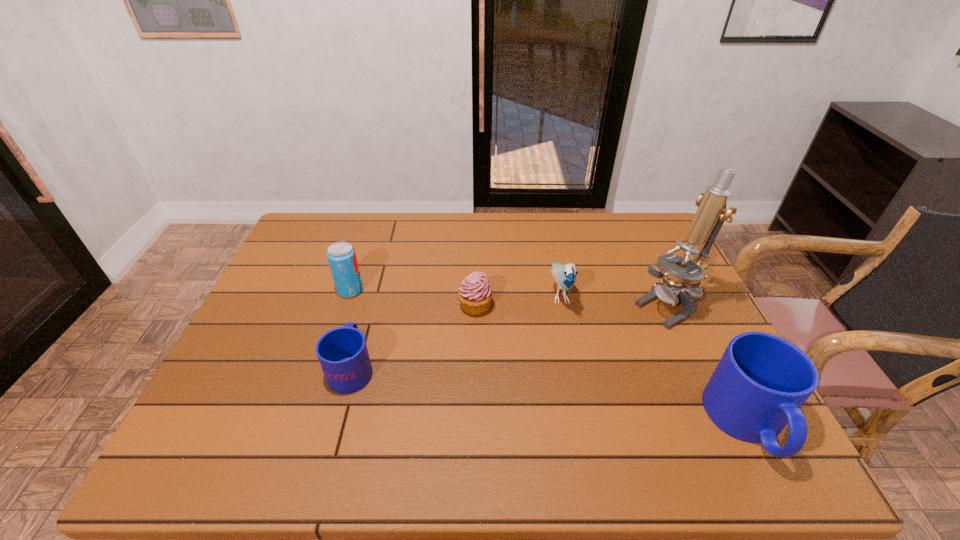
Locate an element on the screen. The image size is (960, 540). free area in between the tallest object and the cupcake is located at coordinates (572, 307).

Locate an element on the screen. The image size is (960, 540). vacant area that lies between the taller mug and the third object from right to left is located at coordinates (654, 357).

Find the location of a particular element. The height and width of the screenshot is (540, 960). object that ranks as the third closest to the soda can is located at coordinates (564, 276).

The height and width of the screenshot is (540, 960). Find the location of `object that is the fifth nearest to the soda can`. object that is the fifth nearest to the soda can is located at coordinates (761, 381).

Locate an element on the screen. The height and width of the screenshot is (540, 960). free space that satisfies the following two spatial constraints: 1. on the side with the handle of the left mug; 2. on the right side of the tallest object is located at coordinates (369, 307).

You are a GUI agent. You are given a task and a screenshot of the screen. Output one action in this format:
    pyautogui.click(x=<x>, y=<y>)
    Task: Click on the vacant space that satisfies the following two spatial constraints: 1. on the front side of the fourth object from right to left; 2. on the left side of the soda can
    
    Given the screenshot: What is the action you would take?
    pyautogui.click(x=345, y=306)